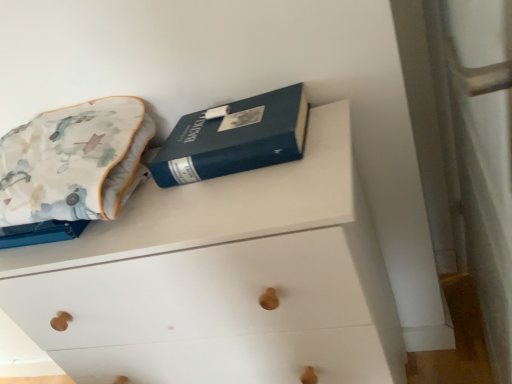
The image size is (512, 384). What do you see at coordinates (222, 279) in the screenshot?
I see `white matte chest of drawers at upper center` at bounding box center [222, 279].

This screenshot has height=384, width=512. I want to click on white matte chest of drawers at upper center, so tap(222, 279).

I want to click on fluffy cotton throw pillow at upper left, so click(x=71, y=161).

Image resolution: width=512 pixels, height=384 pixels. What do you see at coordinates (71, 161) in the screenshot?
I see `fluffy cotton throw pillow at upper left` at bounding box center [71, 161].

Image resolution: width=512 pixels, height=384 pixels. I want to click on blue hardcover book at upper center, so click(234, 138).

The image size is (512, 384). I want to click on white matte chest of drawers at upper center, so [222, 279].

From a real-world perspective, is white matte chest of drawers at upper center above or below fluffy cotton throw pillow at upper left?

In terms of real-world spatial position, white matte chest of drawers at upper center is below fluffy cotton throw pillow at upper left.

From the image's perspective, between white matte chest of drawers at upper center and fluffy cotton throw pillow at upper left, which one is located above?

fluffy cotton throw pillow at upper left, from the image's perspective.

Are white matte chest of drawers at upper center and fluffy cotton throw pillow at upper left beside each other?

No, white matte chest of drawers at upper center is not with fluffy cotton throw pillow at upper left.

Looking at this image, from their relative heights in the image, would you say fluffy cotton throw pillow at upper left is taller or shorter than blue hardcover book at upper center?

Considering their sizes, fluffy cotton throw pillow at upper left has more height than blue hardcover book at upper center.

Between fluffy cotton throw pillow at upper left and blue hardcover book at upper center, which one is positioned behind?

Positioned behind is blue hardcover book at upper center.

The height and width of the screenshot is (384, 512). I want to click on paperback book lying behind the fluffy cotton throw pillow at upper left, so click(234, 138).

Looking at this image, relative to white matte chest of drawers at upper center, is blue hardcover book at upper center in front or behind?

Visually, blue hardcover book at upper center is located behind white matte chest of drawers at upper center.

Between blue hardcover book at upper center and white matte chest of drawers at upper center, which one has smaller width?

Thinner between the two is blue hardcover book at upper center.

Based on their positions, is blue hardcover book at upper center located to the left or right of white matte chest of drawers at upper center?

From the image, it's evident that blue hardcover book at upper center is to the left of white matte chest of drawers at upper center.

From the picture: Is fluffy cotton throw pillow at upper left to the right of white matte chest of drawers at upper center from the viewer's perspective?

No, fluffy cotton throw pillow at upper left is not to the right of white matte chest of drawers at upper center.

Looking at this image, does fluffy cotton throw pillow at upper left contain white matte chest of drawers at upper center?

No.

From a real-world perspective, between fluffy cotton throw pillow at upper left and white matte chest of drawers at upper center, who is vertically lower?

In real-world perspective, white matte chest of drawers at upper center is lower.

Is blue hardcover book at upper center located within white matte chest of drawers at upper center?

No, blue hardcover book at upper center is located outside of white matte chest of drawers at upper center.

Where is `chest of drawers on the right of blue hardcover book at upper center`? chest of drawers on the right of blue hardcover book at upper center is located at coordinates (222, 279).

Does white matte chest of drawers at upper center have a larger size compared to blue hardcover book at upper center?

Yes, white matte chest of drawers at upper center is bigger than blue hardcover book at upper center.

Considering the relative sizes of white matte chest of drawers at upper center and blue hardcover book at upper center in the image provided, is white matte chest of drawers at upper center taller than blue hardcover book at upper center?

Yes.

From the image's perspective, which object appears higher, blue hardcover book at upper center or fluffy cotton throw pillow at upper left?

blue hardcover book at upper center, from the image's perspective.

Could you tell me if blue hardcover book at upper center is facing fluffy cotton throw pillow at upper left?

No.

What's the angular difference between blue hardcover book at upper center and fluffy cotton throw pillow at upper left's facing directions?

The angle between the facing direction of blue hardcover book at upper center and the facing direction of fluffy cotton throw pillow at upper left is 0.00234 degrees.

Find the location of a particular element. This screenshot has height=384, width=512. the chest of drawers located underneath the fluffy cotton throw pillow at upper left (from a real-world perspective) is located at coordinates (222, 279).

There is a blue hardcover book at upper center. Where is `throw pillow above it (from a real-world perspective)`? Image resolution: width=512 pixels, height=384 pixels. throw pillow above it (from a real-world perspective) is located at coordinates (71, 161).

When comparing their distances from white matte chest of drawers at upper center, does fluffy cotton throw pillow at upper left or blue hardcover book at upper center seem further?

Based on the image, fluffy cotton throw pillow at upper left appears to be further to white matte chest of drawers at upper center.

When comparing their distances from fluffy cotton throw pillow at upper left, does white matte chest of drawers at upper center or blue hardcover book at upper center seem closer?

The object closer to fluffy cotton throw pillow at upper left is blue hardcover book at upper center.

Estimate the real-world distances between objects in this image. Which object is further from blue hardcover book at upper center, white matte chest of drawers at upper center or fluffy cotton throw pillow at upper left?

Based on the image, fluffy cotton throw pillow at upper left appears to be further to blue hardcover book at upper center.

From the image, which object appears to be farther from blue hardcover book at upper center, fluffy cotton throw pillow at upper left or white matte chest of drawers at upper center?

fluffy cotton throw pillow at upper left is further to blue hardcover book at upper center.

Which object lies nearer to the anchor point fluffy cotton throw pillow at upper left, blue hardcover book at upper center or white matte chest of drawers at upper center?

blue hardcover book at upper center lies closer to fluffy cotton throw pillow at upper left than the other object.

From the image, which object appears to be farther from white matte chest of drawers at upper center, blue hardcover book at upper center or fluffy cotton throw pillow at upper left?

fluffy cotton throw pillow at upper left is further to white matte chest of drawers at upper center.

In order to click on throw pillow between blue hardcover book at upper center and white matte chest of drawers at upper center from top to bottom in this screenshot , I will do `click(71, 161)`.